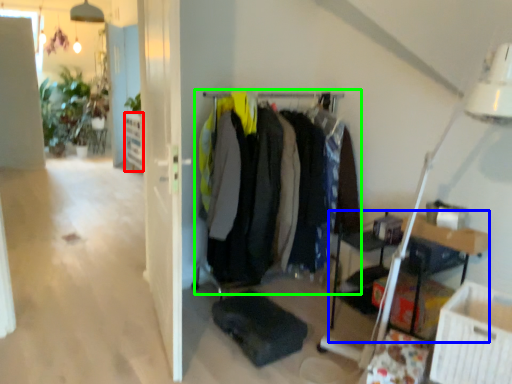
Question: Which object is the closest to the shelf (highlighted by a red box)? Choose among these: table (highlighted by a blue box) or closet (highlighted by a green box).

Choices:
 (A) table
 (B) closet

Answer: (B)